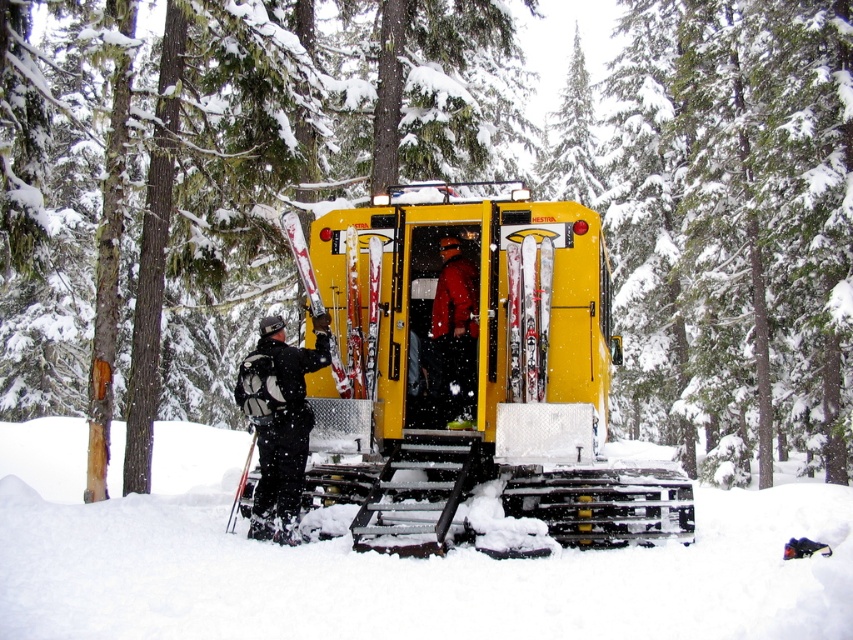
Which is behind, point (415, 260) or point (276, 349)?

The point (415, 260) is more distant.

Identify the location of matte yellow bus at center. This screenshot has height=640, width=853. (474, 365).

This screenshot has height=640, width=853. I want to click on matte yellow bus at center, so click(474, 365).

Find the location of a particular element. The height and width of the screenshot is (640, 853). matte yellow bus at center is located at coordinates (474, 365).

Who is taller, white fluffy snow at lower center or red matte jacket at center?

white fluffy snow at lower center is taller.

Which is in front, point (171, 576) or point (468, 266)?

Point (171, 576) is more forward.

Does point (204, 449) come behind point (462, 346)?

Yes, it is.

The height and width of the screenshot is (640, 853). I want to click on white fluffy snow at lower center, so [x=383, y=563].

Which is behind, point (152, 504) or point (306, 452)?

The point (152, 504) is behind.

Between white fluffy snow at lower center and black matte snowboard at left, which one has more height?

Standing taller between the two is white fluffy snow at lower center.

The width and height of the screenshot is (853, 640). What do you see at coordinates (383, 563) in the screenshot?
I see `white fluffy snow at lower center` at bounding box center [383, 563].

The image size is (853, 640). I want to click on white fluffy snow at lower center, so click(383, 563).